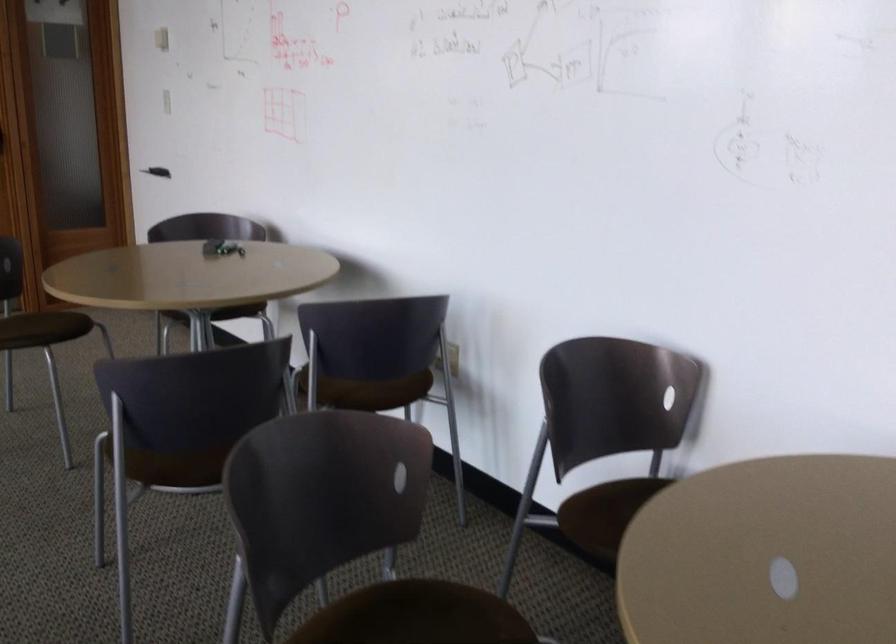
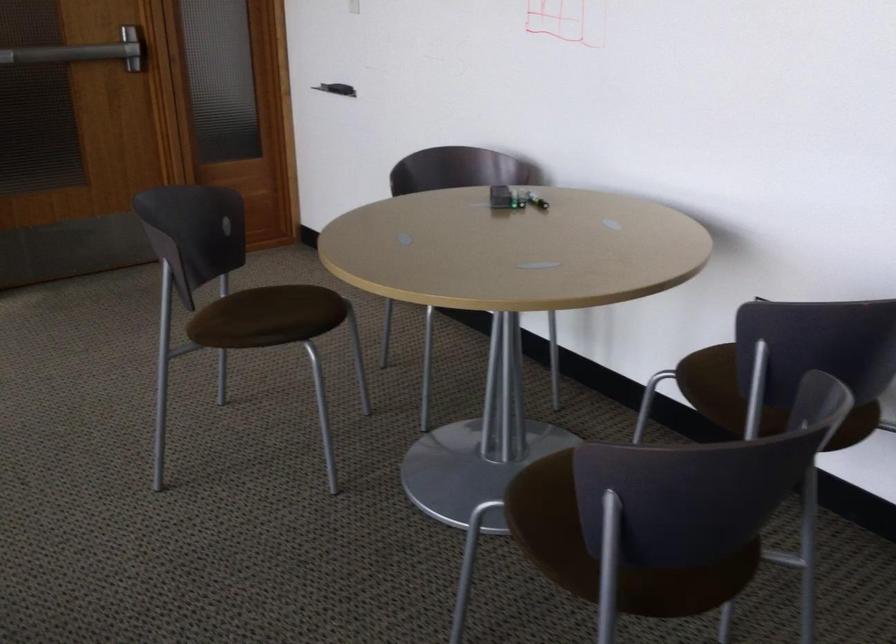
Locate, in the second image, the point that corresponds to pixel 159 438 in the first image.

(554, 524)